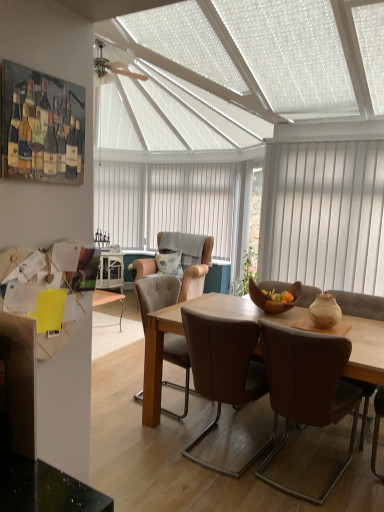
Question: Can you confirm if white wood blinds at right is wider than wooden bowl at center?

Choices:
 (A) no
 (B) yes

Answer: (A)

Question: Can you confirm if white wood blinds at right is shorter than wooden bowl at center?

Choices:
 (A) no
 (B) yes

Answer: (A)

Question: Is white wood blinds at right positioned with its back to wooden bowl at center?

Choices:
 (A) yes
 (B) no

Answer: (B)

Question: From the image's perspective, would you say white wood blinds at right is shown under wooden bowl at center?

Choices:
 (A) no
 (B) yes

Answer: (A)

Question: Can you confirm if white wood blinds at right is smaller than wooden bowl at center?

Choices:
 (A) no
 (B) yes

Answer: (A)

Question: Is the depth of white wood blinds at right greater than that of wooden bowl at center?

Choices:
 (A) no
 (B) yes

Answer: (B)

Question: Is leather armchair at center, arranged as the 1th chair when viewed from the back, outside white vertical blinds at center?

Choices:
 (A) no
 (B) yes

Answer: (B)

Question: Is leather armchair at center, which is counted as the fourth chair, starting from the front, in contact with white vertical blinds at center?

Choices:
 (A) yes
 (B) no

Answer: (B)

Question: Is leather armchair at center, arranged as the 1th chair when viewed from the back, facing away from white vertical blinds at center?

Choices:
 (A) no
 (B) yes

Answer: (A)

Question: From a real-world perspective, is leather armchair at center, which is counted as the fourth chair, starting from the front, beneath white vertical blinds at center?

Choices:
 (A) yes
 (B) no

Answer: (A)

Question: Considering the relative sizes of leather armchair at center, which is counted as the fourth chair, starting from the front, and white vertical blinds at center in the image provided, is leather armchair at center, which is counted as the fourth chair, starting from the front, taller than white vertical blinds at center?

Choices:
 (A) yes
 (B) no

Answer: (B)

Question: Is leather armchair at center, which is counted as the fourth chair, starting from the front, positioned behind white vertical blinds at center?

Choices:
 (A) yes
 (B) no

Answer: (B)

Question: Considering the relative positions of leather armchair at center, which is counted as the fourth chair, starting from the front, and brown leather chair at center, positioned as the 1th chair in front-to-back order, in the image provided, is leather armchair at center, which is counted as the fourth chair, starting from the front, to the right of brown leather chair at center, positioned as the 1th chair in front-to-back order, from the viewer's perspective?

Choices:
 (A) no
 (B) yes

Answer: (A)